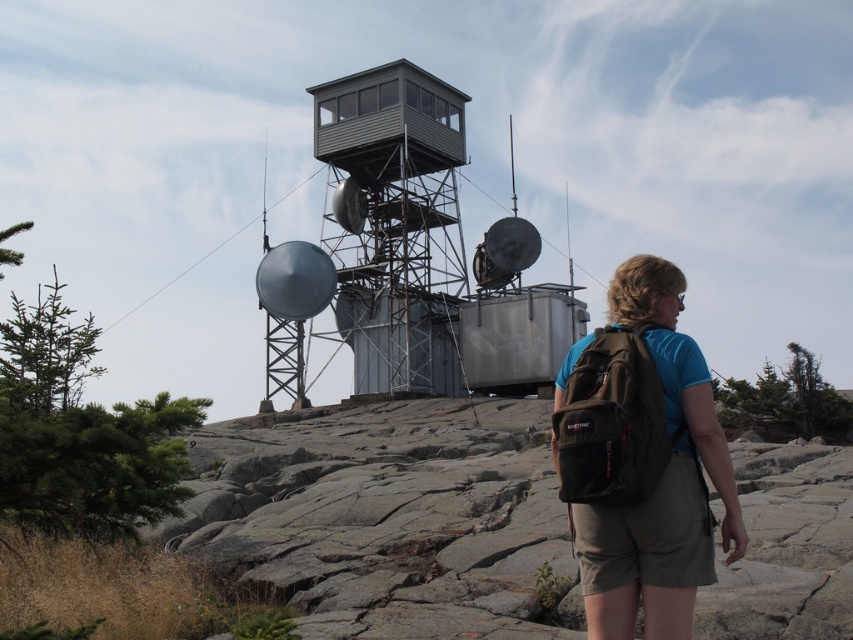
Can you confirm if brown fabric backpack at right is taller than gray metallic observation tower at center?

In fact, brown fabric backpack at right may be shorter than gray metallic observation tower at center.

I want to click on brown fabric backpack at right, so click(641, 458).

Is point (641, 280) in front of point (368, 248)?

Yes, point (641, 280) is closer to viewer.

In order to click on brown fabric backpack at right in this screenshot , I will do `click(641, 458)`.

Which is below, metallic gray observation tower at center or gray metallic observation tower at center?

Positioned lower is metallic gray observation tower at center.

Can you confirm if metallic gray observation tower at center is bigger than gray metallic observation tower at center?

Yes.

Between point (457, 240) and point (434, 124), which one is positioned in front?

Point (434, 124)

Identify the location of metallic gray observation tower at center. The width and height of the screenshot is (853, 640). (395, 225).

Can you confirm if brown fabric backpack at right is positioned below metallic gray observation tower at center?

Yes.

Can you confirm if brown fabric backpack at right is smaller than metallic gray observation tower at center?

Correct, brown fabric backpack at right occupies less space than metallic gray observation tower at center.

I want to click on brown fabric backpack at right, so click(641, 458).